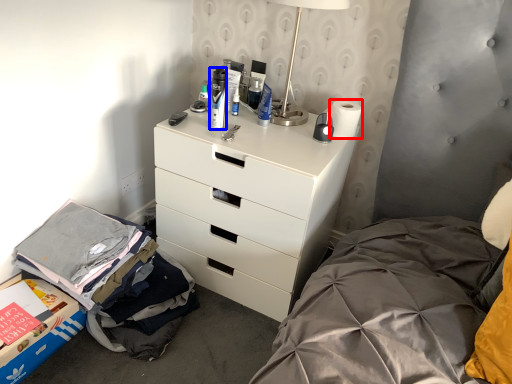
Question: Which point is further to the camera, toilet paper (highlighted by a red box) or toiletry (highlighted by a blue box)?

Choices:
 (A) toilet paper
 (B) toiletry

Answer: (A)